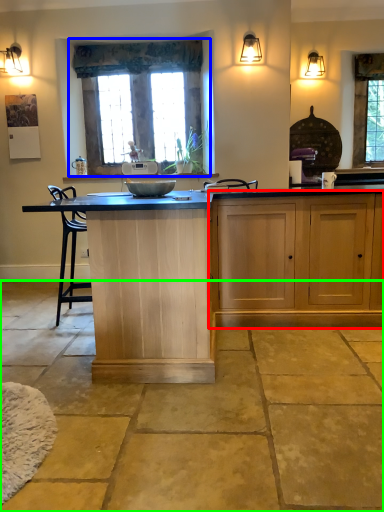
Question: Which is nearer to the cabinetry (highlighted by a red box)? window (highlighted by a blue box) or concrete (highlighted by a green box).

Choices:
 (A) window
 (B) concrete

Answer: (B)